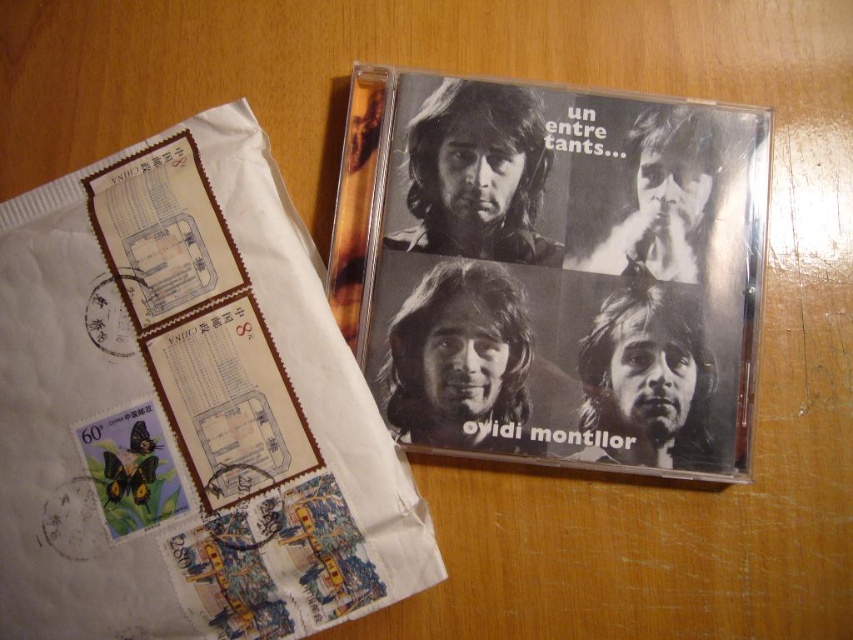
Locate an element on the screen. black matte cd at upper left is located at coordinates (187, 410).

Between black matte cd at upper left and black matte cd at upper right, which one appears on the right side from the viewer's perspective?

From the viewer's perspective, black matte cd at upper right appears more on the right side.

Is point (207, 534) more distant than point (757, 237)?

That is False.

Where is `black matte cd at upper left`? This screenshot has height=640, width=853. black matte cd at upper left is located at coordinates (187, 410).